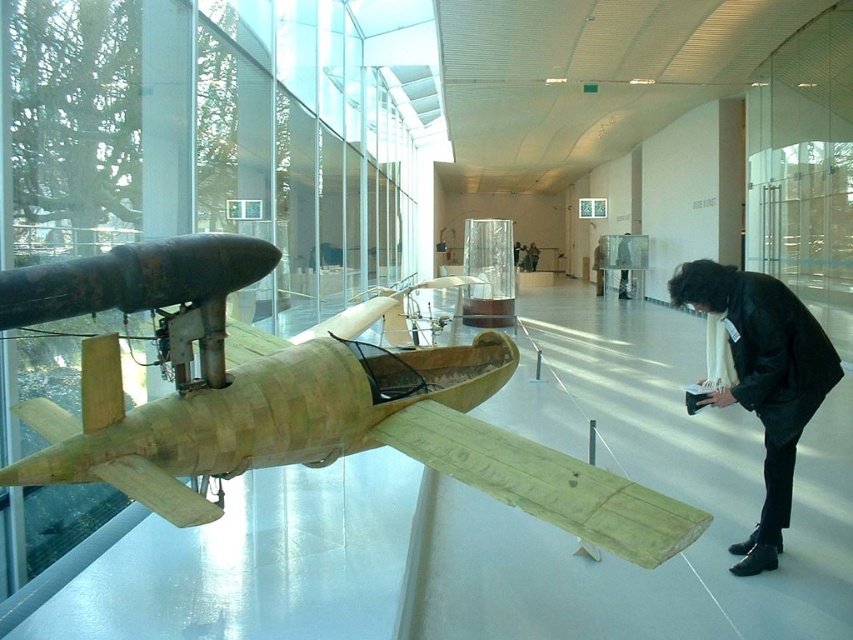
You are a GUI agent. You are given a task and a screenshot of the screen. Output one action in this format:
    pyautogui.click(x=<x>, y=<y>)
    Task: Click on the wooden airplane at left
    Image resolution: width=853 pixels, height=640 pixels.
    Given the screenshot: What is the action you would take?
    pyautogui.click(x=294, y=403)

Does point (700, 529) lie in front of point (686, 272)?

That is True.

Image resolution: width=853 pixels, height=640 pixels. I want to click on wooden airplane at left, so click(294, 403).